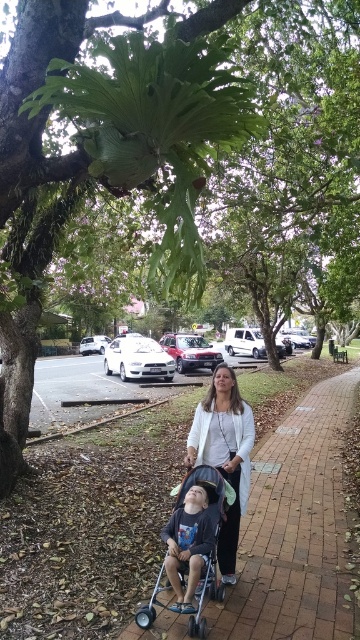
Looking at this image, you are standing at the corner of the street and want to walk directly towards the metallic blue stroller at center. According to the coordinates provided, in which direction should you move relative to your current position?

The metallic blue stroller at center is located at coordinates point (201, 536). Since you are at the corner, you should move towards the center of the street to reach the stroller.

You are a photographer standing at the edge of the sidewalk. You want to take a photo of the child in the stroller while ensuring the white matte jacket at center is in the frame. Based on the jacket location at point 0.711, 0.625, where should you position yourself to include both the child and the jacket in the shot?

To include both the child and the white matte jacket at center in the photo, position yourself so the camera is aimed towards the jacket located at point (225, 454). This ensures the jacket remains centered while capturing the child in the stroller within the frame.

You are a photographer standing on the sidewalk. You want to take a photo of the white matte jacket at center and the dark gray fabric stroller at lower center. Which object should you focus on first if you want the taller one to be in focus?

The white matte jacket at center is taller than the dark gray fabric stroller at lower center, so you should focus on the white matte jacket at center first to ensure it is in focus.